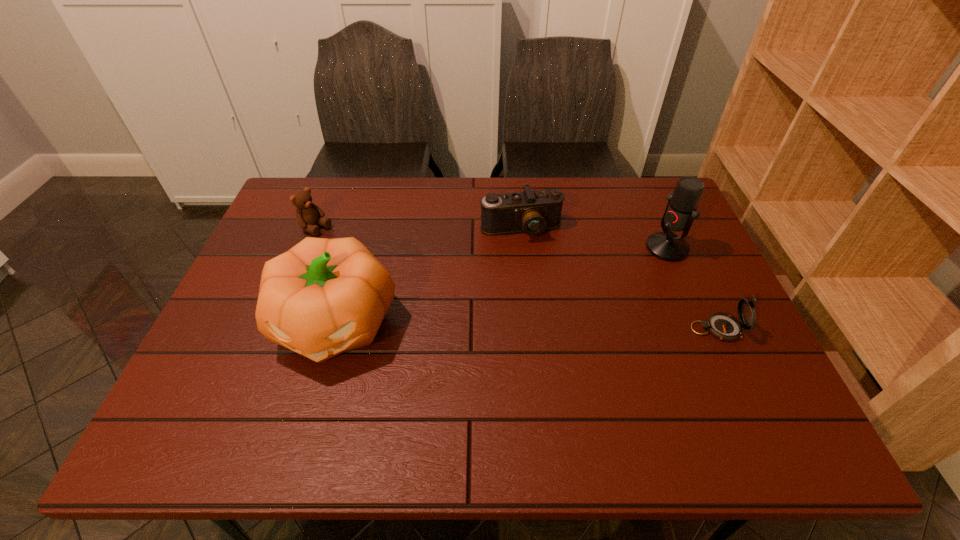
The height and width of the screenshot is (540, 960). What are the coordinates of `vacant space on the desktop that is between the pumpkin and the compass and is positioned on the side of the microphone with the red ring` in the screenshot? It's located at (493, 326).

Image resolution: width=960 pixels, height=540 pixels. I want to click on vacant spot on the desktop that is between the pumpkin and the compass and is positioned on the lens of the camera, so click(555, 327).

Locate an element on the screen. Image resolution: width=960 pixels, height=540 pixels. free spot on the desktop that is between the pumpkin and the compass and is positioned on the face of the teddy bear is located at coordinates (489, 326).